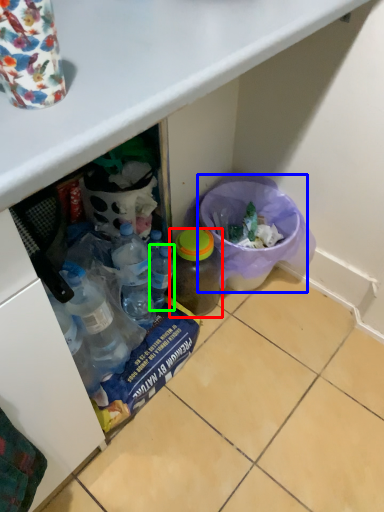
Question: Which is farther away from bottle (highlighted by a red box)? recycling bin (highlighted by a blue box) or bottle (highlighted by a green box)?

Choices:
 (A) recycling bin
 (B) bottle

Answer: (A)